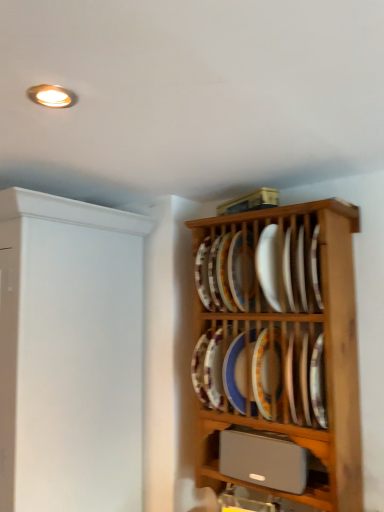
Question: From a real-world perspective, is white matte cabinet at left positioned under wooden plate rack at upper right based on gravity?

Choices:
 (A) no
 (B) yes

Answer: (B)

Question: Can you confirm if white matte cabinet at left is positioned to the left of wooden plate rack at upper right?

Choices:
 (A) no
 (B) yes

Answer: (B)

Question: Considering the relative sizes of white matte cabinet at left and wooden plate rack at upper right in the image provided, is white matte cabinet at left shorter than wooden plate rack at upper right?

Choices:
 (A) yes
 (B) no

Answer: (B)

Question: From the image's perspective, is white matte cabinet at left below wooden plate rack at upper right?

Choices:
 (A) yes
 (B) no

Answer: (A)

Question: Does white matte cabinet at left appear on the right side of wooden plate rack at upper right?

Choices:
 (A) no
 (B) yes

Answer: (A)

Question: Can you confirm if white matte cabinet at left is bigger than wooden plate rack at upper right?

Choices:
 (A) yes
 (B) no

Answer: (A)

Question: Is porcelain plate at center, which ranks as the 2th platter in top-to-bottom order, positioned before silver metallic speaker at lower center?

Choices:
 (A) no
 (B) yes

Answer: (A)

Question: Can silver metallic speaker at lower center be found inside porcelain plate at center, positioned as the fourth platter in bottom-to-top order?

Choices:
 (A) yes
 (B) no

Answer: (B)

Question: Can you confirm if porcelain plate at center, positioned as the fourth platter in bottom-to-top order, is thinner than silver metallic speaker at lower center?

Choices:
 (A) no
 (B) yes

Answer: (B)

Question: Is porcelain plate at center, which ranks as the 2th platter in top-to-bottom order, taller than silver metallic speaker at lower center?

Choices:
 (A) no
 (B) yes

Answer: (B)

Question: Does porcelain plate at center, which ranks as the 2th platter in top-to-bottom order, have a smaller size compared to silver metallic speaker at lower center?

Choices:
 (A) yes
 (B) no

Answer: (A)

Question: Does porcelain plate at center, positioned as the fourth platter in bottom-to-top order, appear on the left side of silver metallic speaker at lower center?

Choices:
 (A) no
 (B) yes

Answer: (B)

Question: Does white glossy plate at center, placed as the 1th platter when sorted from top to bottom, have a greater width compared to porcelain plate at center, acting as the third platter starting from the bottom?

Choices:
 (A) no
 (B) yes

Answer: (B)